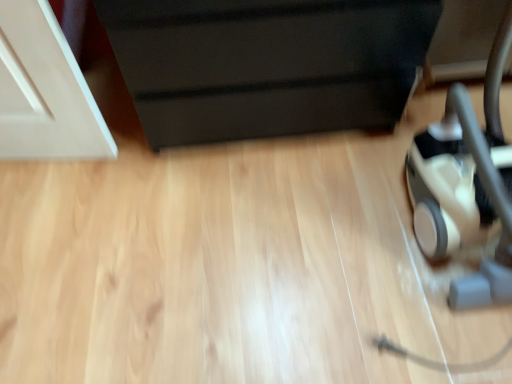
You are a GUI agent. You are given a task and a screenshot of the screen. Output one action in this format:
    pyautogui.click(x=<x>, y=<y>)
    Task: Click on the free space to the left of beige rubber baby carriage at lower right
    Image resolution: width=512 pixels, height=384 pixels.
    Given the screenshot: What is the action you would take?
    pyautogui.click(x=342, y=246)